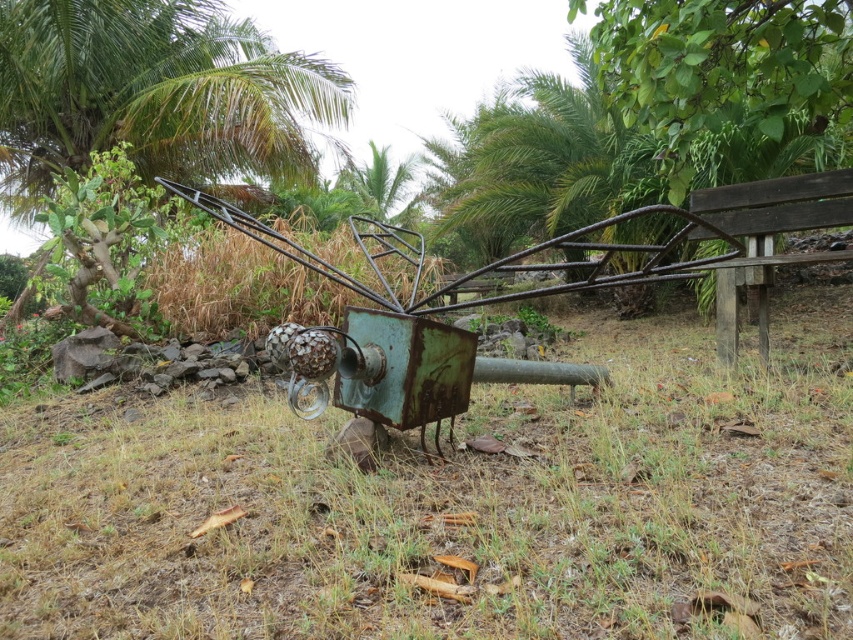
Question: Is green wood bench at right positioned before green leafy palm tree at upper center?

Choices:
 (A) no
 (B) yes

Answer: (B)

Question: Does green leafy palm tree at upper left lie in front of dark brown wooden bench at right?

Choices:
 (A) no
 (B) yes

Answer: (A)

Question: Which object is positioned farthest from the green wood bench at right?

Choices:
 (A) rusty metal sculpture at center
 (B) green leafy palm tree at upper left
 (C) green leafy palm tree at upper center
 (D) dark brown wooden bench at right

Answer: (C)

Question: In this image, where is green leafy palm tree at upper left located relative to rusty metal sculpture at center?

Choices:
 (A) below
 (B) above

Answer: (B)

Question: Which point appears closest to the camera in this image?

Choices:
 (A) (407, 204)
 (B) (666, 84)

Answer: (B)

Question: Which of the following is the farthest from the observer?

Choices:
 (A) green grass at center
 (B) green wood bench at right
 (C) rusty metal sculpture at center
 (D) dark brown wooden bench at right

Answer: (C)